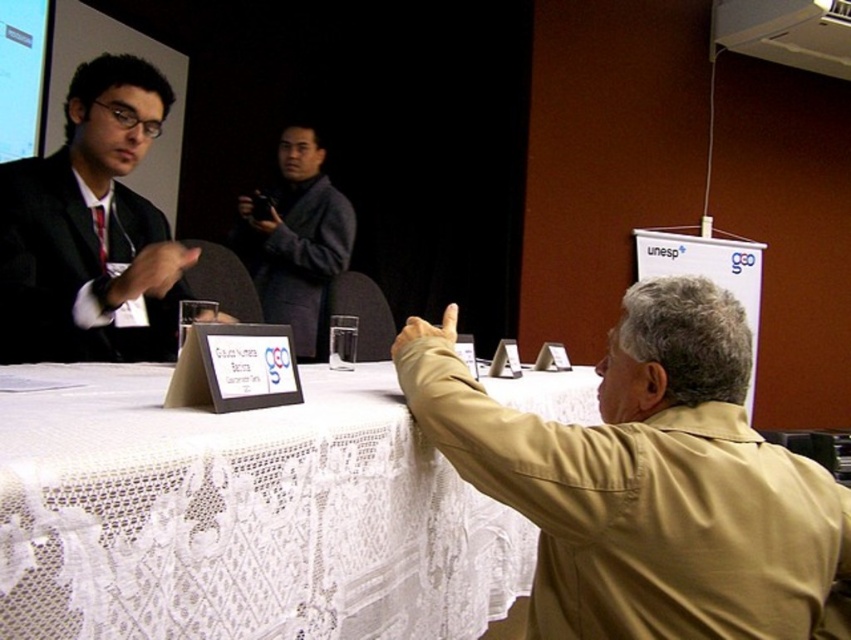
You are a guest at the event and want to see the presentation on the matte white projection screen at upper left. Where should you stand in relation to the white lace tablecloth at center to have a clear view?

To see the matte white projection screen at upper left clearly, you should stand in front of the white lace tablecloth at center since it is positioned below the screen, allowing an unobstructed view from that position.

You are organizing a small event and need to determine if the khaki leather jacket at upper right can fit on the white lace tablecloth at center. Based on their sizes, can it be placed there?

The white lace tablecloth at center is wider than the khaki leather jacket at upper right, so yes, the khaki leather jacket at upper right can fit on the white lace tablecloth at center.

You are standing at the entrance of the conference room and see the matte black suit at left and the dark gray suit at center. Which one is nearer to you?

The matte black suit at left is closer to the viewer than the dark gray suit at center, so the matte black suit at left is nearer to you.